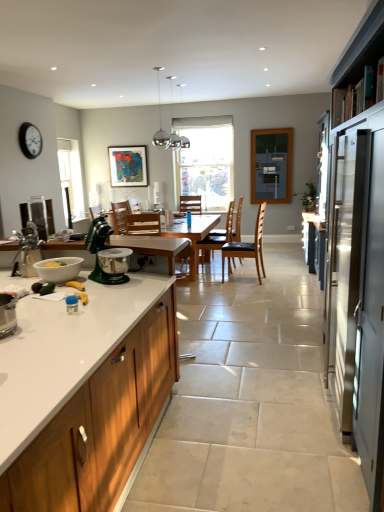
Question: Considering the positions of white glossy mixing bowl at lower left and matte wooden picture frame at upper center in the image, is white glossy mixing bowl at lower left wider or thinner than matte wooden picture frame at upper center?

Choices:
 (A) thin
 (B) wide

Answer: (B)

Question: From the image's perspective, relative to matte wooden picture frame at upper center, is white glossy mixing bowl at lower left above or below?

Choices:
 (A) below
 (B) above

Answer: (A)

Question: Based on their relative distances, which object is farther from the matte black clock at upper left?

Choices:
 (A) wooden cabinet at left
 (B) black leather chair at center, placed as the 2th chair when sorted from front to back
 (C) white glossy mixing bowl at lower left
 (D) transparent glass window at center
 (E) metallic silver toaster at lower left, the 3th appliance viewed from the back

Answer: (A)

Question: Which is nearer to the matte wooden picture frame at upper center?

Choices:
 (A) black leather chair at center, the third chair viewed from the front
 (B) white glossy mixing bowl at lower left
 (C) wooden table at center
 (D) satin silver mixer at left, placed as the third appliance when sorted from right to left
 (E) matte black clock at upper left

Answer: (E)